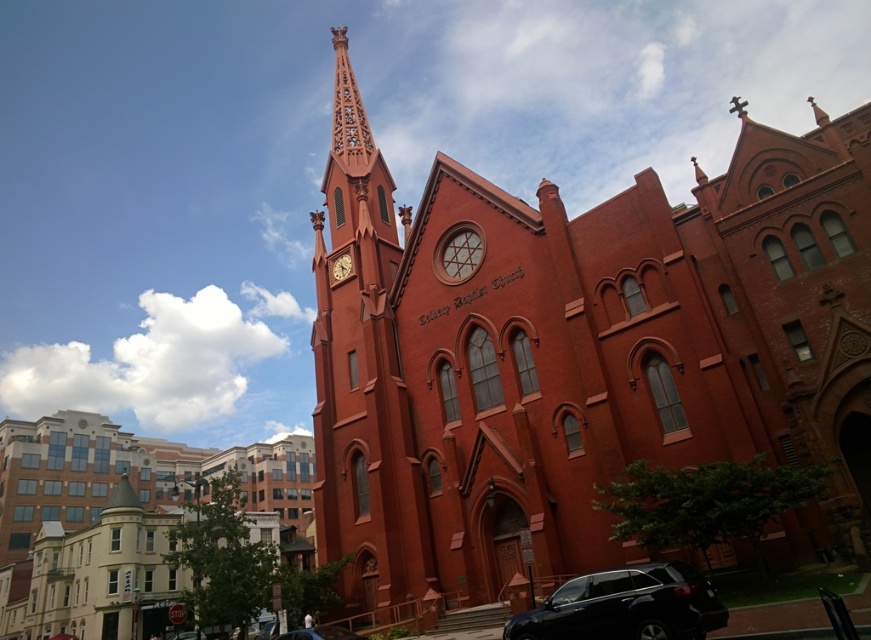
Who is positioned more to the right, smooth brick tower at center or matte brown clock at upper center?

Positioned to the right is smooth brick tower at center.

Is point (386, 224) closer to camera compared to point (346, 272)?

No.

Identify the location of smooth brick tower at center. This screenshot has width=871, height=640. (362, 372).

Is matte brick church at center positioned in front of smooth brick tower at center?

That is True.

Is the position of matte brick church at center more distant than that of smooth brick tower at center?

No, it is not.

Where is `matte brick church at center`? Image resolution: width=871 pixels, height=640 pixels. matte brick church at center is located at coordinates (579, 355).

Identify the location of matte brick church at center. (579, 355).

The image size is (871, 640). Find the location of `black matte suv at lower right`. black matte suv at lower right is located at coordinates (625, 605).

Based on the photo, who is lower down, black matte suv at lower right or matte brown clock at upper center?

black matte suv at lower right is lower down.

Is point (693, 620) more distant than point (341, 268)?

That is False.

Find the location of a particular element. The width and height of the screenshot is (871, 640). black matte suv at lower right is located at coordinates (625, 605).